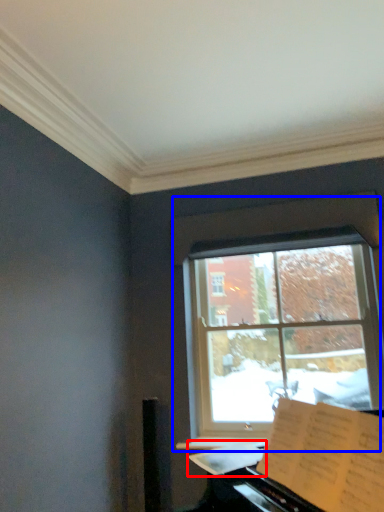
Question: Which object appears closest to the camera in this image, sheet music (highlighted by a red box) or window (highlighted by a blue box)?

Choices:
 (A) sheet music
 (B) window

Answer: (A)